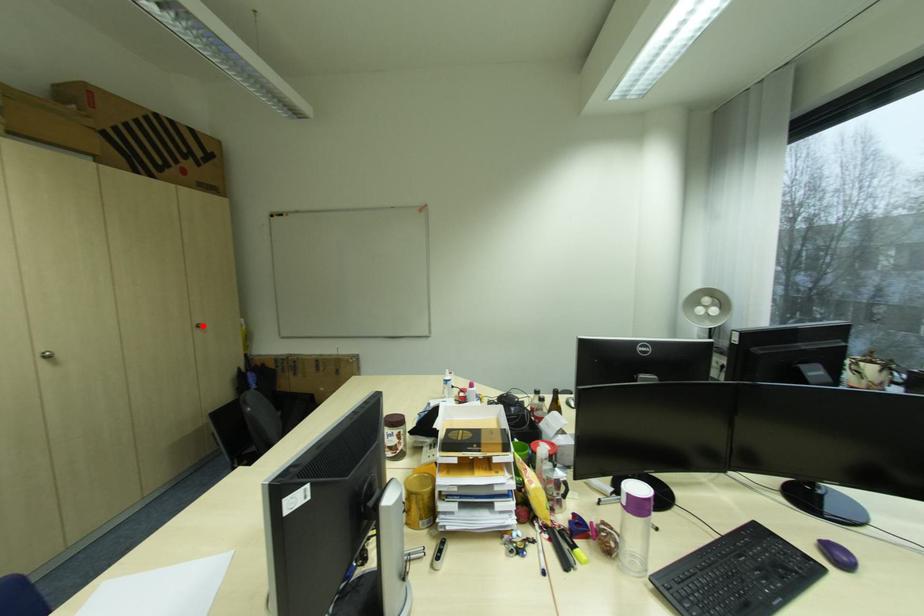
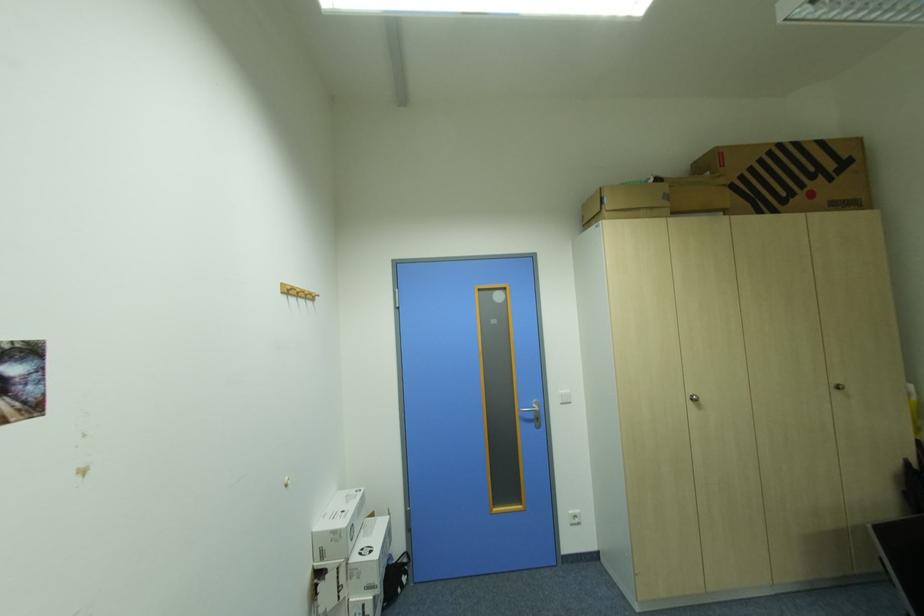
Where in the second image is the point corresponding to the highlighted location from the first image?

(840, 386)